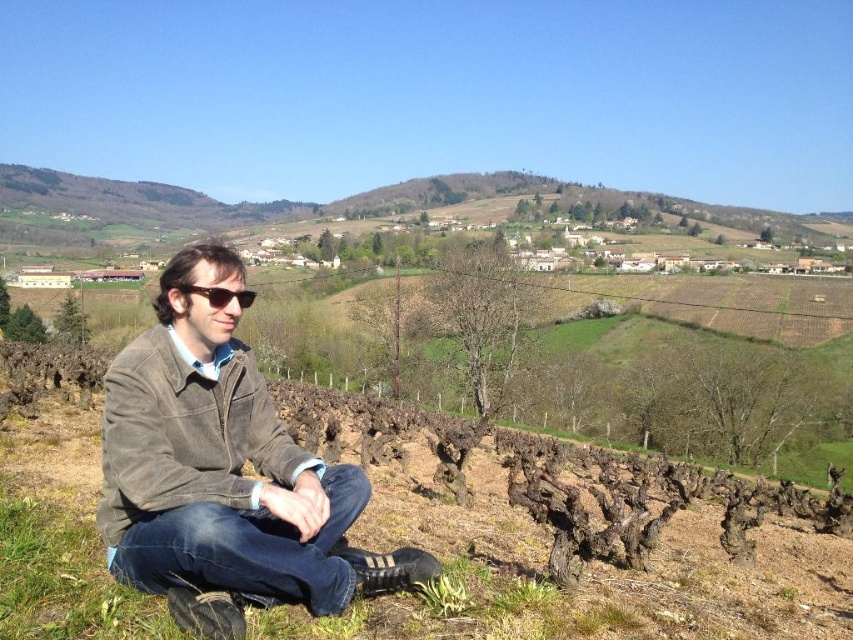
You are a photographer trying to capture the person in the vineyard. You notice the brown suede jacket at center and the matte black sunglasses at center. Which object is closer to the camera?

The brown suede jacket at center is positioned under the matte black sunglasses at center, indicating it is closer to the camera.

You are a photographer trying to capture a closeup of the brown suede jacket at center and the matte black sunglasses at center. Since you want to focus on both items, which one should you adjust the camera focus on first to ensure the other is also in focus?

The brown suede jacket at center is taller than the matte black sunglasses at center, so you should focus on the brown suede jacket at center first to ensure both are in focus.

You are a fashion photographer who needs to capture the brown suede jacket at center and the brown corduroy jacket at lower left in the same frame. Which jacket is positioned lower in the image?

The brown suede jacket at center is located below the brown corduroy jacket at lower left, so the brown suede jacket at center is positioned lower in the image.